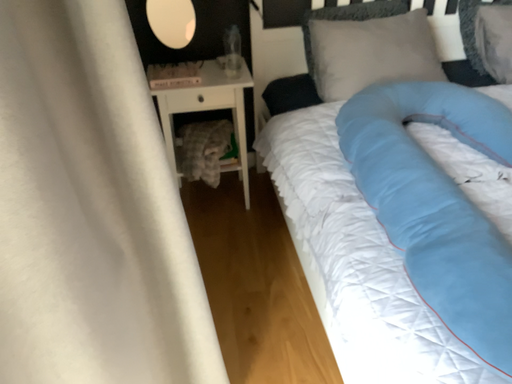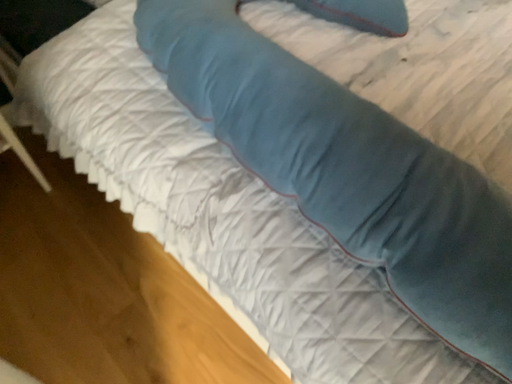
Question: Which way did the camera rotate in the video?

Choices:
 (A) rotated right
 (B) rotated left

Answer: (A)